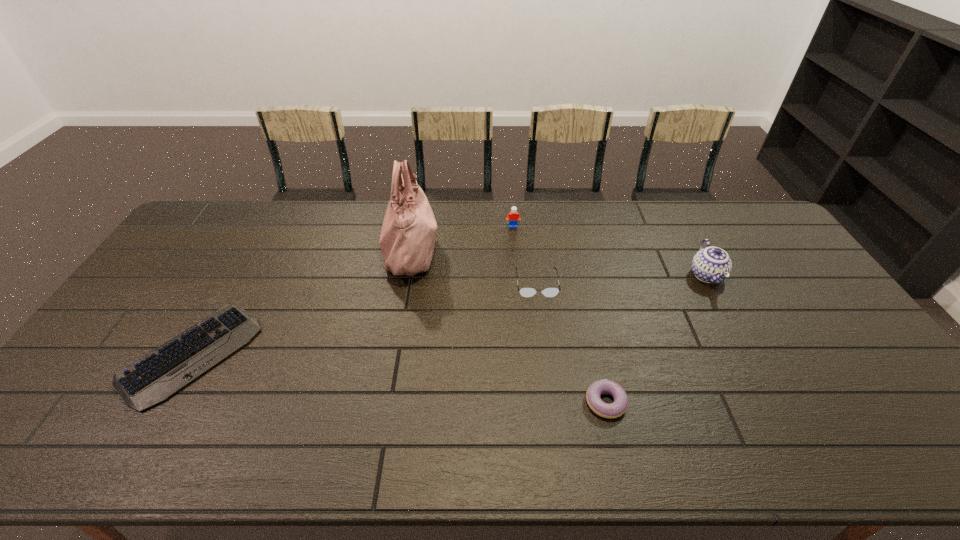
You are a GUI agent. You are given a task and a screenshot of the screen. Output one action in this format:
    pyautogui.click(x=<x>, y=<y>)
    Task: Click on the vacant space at the near edge
    
    Given the screenshot: What is the action you would take?
    pyautogui.click(x=713, y=430)

Find the location of a particular element. vacant space at the right edge of the desktop is located at coordinates (744, 245).

In the image, there is a desktop. Where is `vacant space at the far left corner`? The width and height of the screenshot is (960, 540). vacant space at the far left corner is located at coordinates (200, 233).

This screenshot has width=960, height=540. In order to click on unoccupied area between the Lego and the chinaware in this screenshot , I will do `click(610, 251)`.

Where is `vacant area that lies between the computer keyboard and the doughnut`? The height and width of the screenshot is (540, 960). vacant area that lies between the computer keyboard and the doughnut is located at coordinates (399, 379).

The image size is (960, 540). Identify the location of blank region between the fifth tallest object and the second object from left to right. (508, 326).

Locate an element on the screen. free spot between the spectacles and the doughnut is located at coordinates (571, 343).

I want to click on vacant space that's between the rightmost object and the fifth object from right to left, so click(x=559, y=262).

Locate an element on the screen. Image resolution: width=960 pixels, height=540 pixels. blank region between the spectacles and the computer keyboard is located at coordinates (365, 319).

This screenshot has height=540, width=960. In order to click on vacant area between the computer keyboard and the spectacles in this screenshot , I will do tap(365, 319).